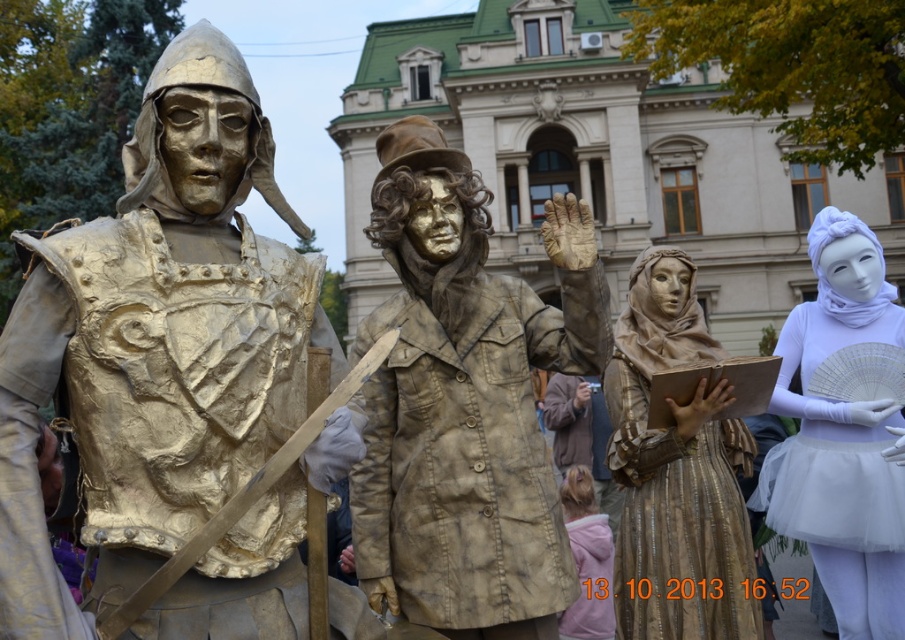
Question: Is gold textured coat at center to the right of white tulle skirt at right from the viewer's perspective?

Choices:
 (A) no
 (B) yes

Answer: (A)

Question: Which object appears farthest from the camera in this image?

Choices:
 (A) gold textured coat at center
 (B) white tulle skirt at right
 (C) bronze armor at left

Answer: (B)

Question: Which object is positioned farthest from the gold textured fabric dress at center?

Choices:
 (A) gold textured coat at center
 (B) white tulle skirt at right
 (C) bronze armor at left

Answer: (C)

Question: Observing the image, what is the correct spatial positioning of bronze armor at left in reference to gold textured fabric dress at center?

Choices:
 (A) above
 (B) below

Answer: (A)

Question: Among these objects, which one is farthest from the camera?

Choices:
 (A) gold textured fabric dress at center
 (B) bronze armor at left

Answer: (A)

Question: Is bronze armor at left smaller than white tulle skirt at right?

Choices:
 (A) no
 (B) yes

Answer: (B)